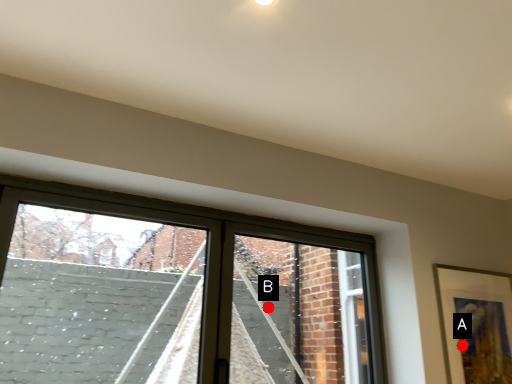
Question: Two points are circled on the image, labeled by A and B beside each circle. Which of the following is the farthest from the observer?

Choices:
 (A) A is further
 (B) B is further

Answer: (B)